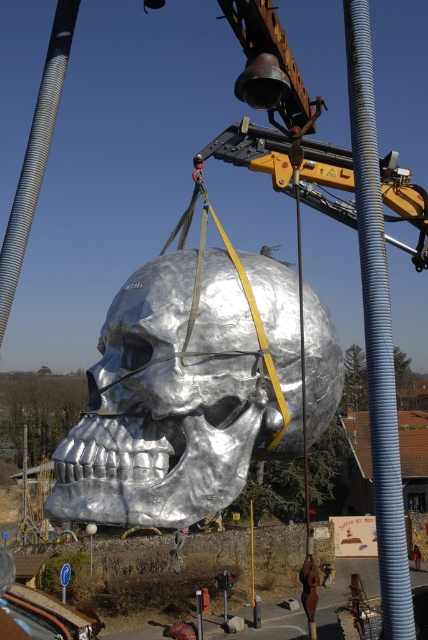
Who is positioned more to the left, gray corrugated pipe at center or brushed metal construction worker at lower center?

From the viewer's perspective, gray corrugated pipe at center appears more on the left side.

Image resolution: width=428 pixels, height=640 pixels. What do you see at coordinates (377, 328) in the screenshot?
I see `gray corrugated pipe at center` at bounding box center [377, 328].

Identify the location of gray corrugated pipe at center. Image resolution: width=428 pixels, height=640 pixels. (377, 328).

Between shiny metallic skull at center and brushed metal construction worker at lower center, which one appears on the left side from the viewer's perspective?

From the viewer's perspective, shiny metallic skull at center appears more on the left side.

Who is more distant from viewer, (145, 417) or (419, 566)?

Point (419, 566)

Find the location of a particular element. The image size is (428, 640). shiny metallic skull at center is located at coordinates (168, 401).

Does shiny metallic skull at center have a larger size compared to gray corrugated pipe at center?

No.

Can you confirm if shiny metallic skull at center is thinner than gray corrugated pipe at center?

Incorrect, shiny metallic skull at center's width is not less than gray corrugated pipe at center's.

Is point (315, 317) farther from viewer compared to point (377, 328)?

Yes, point (315, 317) is farther from viewer.

Locate an element on the screen. The height and width of the screenshot is (640, 428). shiny metallic skull at center is located at coordinates (168, 401).